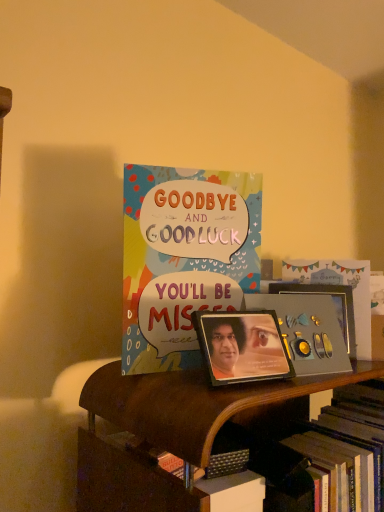
Question: Would you say multicolored paper card at center is inside or outside metallic gold picture frame at center, the 1th picture frame when ordered from back to front?

Choices:
 (A) outside
 (B) inside

Answer: (A)

Question: Based on their sizes in the image, would you say multicolored paper card at center is bigger or smaller than metallic gold picture frame at center, which ranks as the 1th picture frame in right-to-left order?

Choices:
 (A) big
 (B) small

Answer: (A)

Question: Which object is positioned closest to the metallic photo frame at center, arranged as the 2th picture frame when viewed from the back?

Choices:
 (A) wooden bookshelf at lower center
 (B) metallic gold picture frame at center, the 2th picture frame viewed from the front
 (C) multicolored paper card at center

Answer: (A)

Question: Estimate the real-world distances between objects in this image. Which object is closer to the wooden bookshelf at lower center?

Choices:
 (A) metallic gold picture frame at center, the 1th picture frame when ordered from back to front
 (B) metallic photo frame at center, the first picture frame positioned from the front
 (C) multicolored paper card at center

Answer: (B)